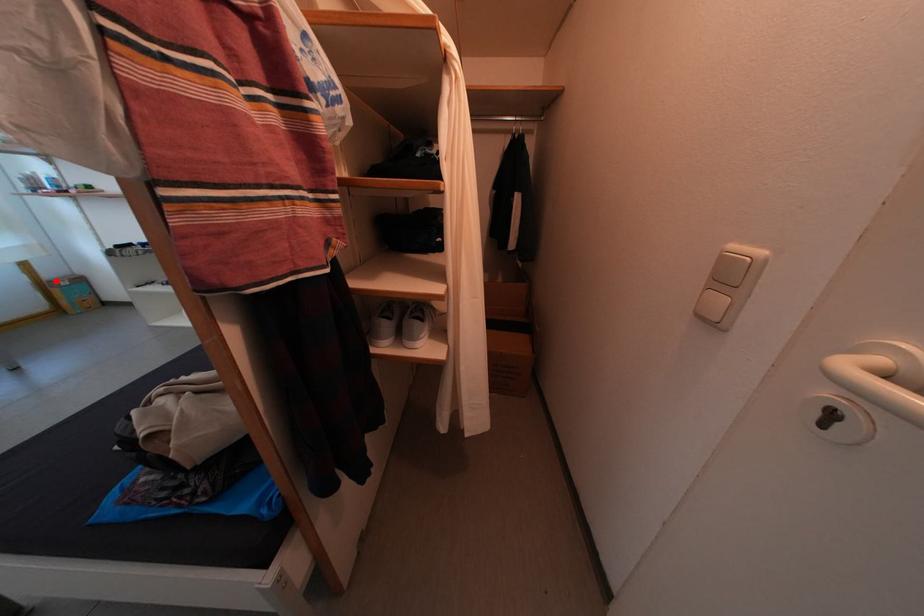
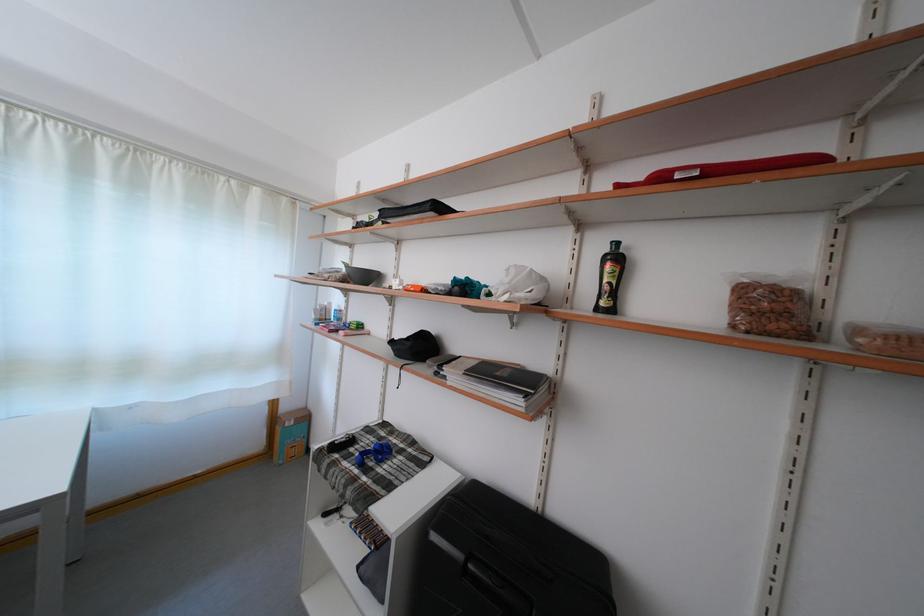
Question: I am providing you with two images of the same scene from different viewpoints. Image1 has a red point marked. In image2, the corresponding 3D location appears at what relative position? Reply with the corresponding letter.

Choices:
 (A) Closer
 (B) Farther

Answer: (A)